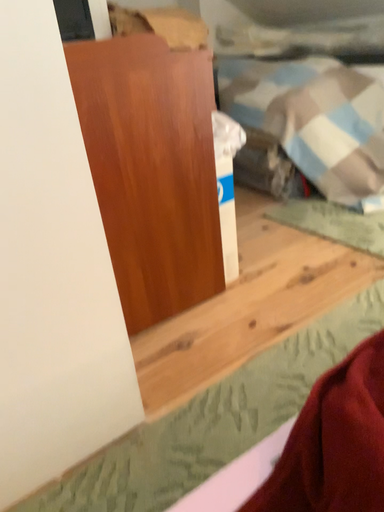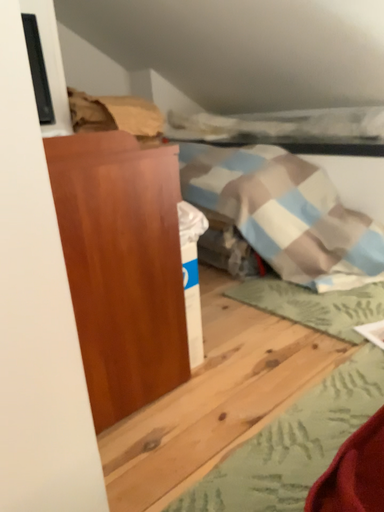
Question: Which way did the camera rotate in the video?

Choices:
 (A) rotated upward
 (B) rotated downward

Answer: (A)